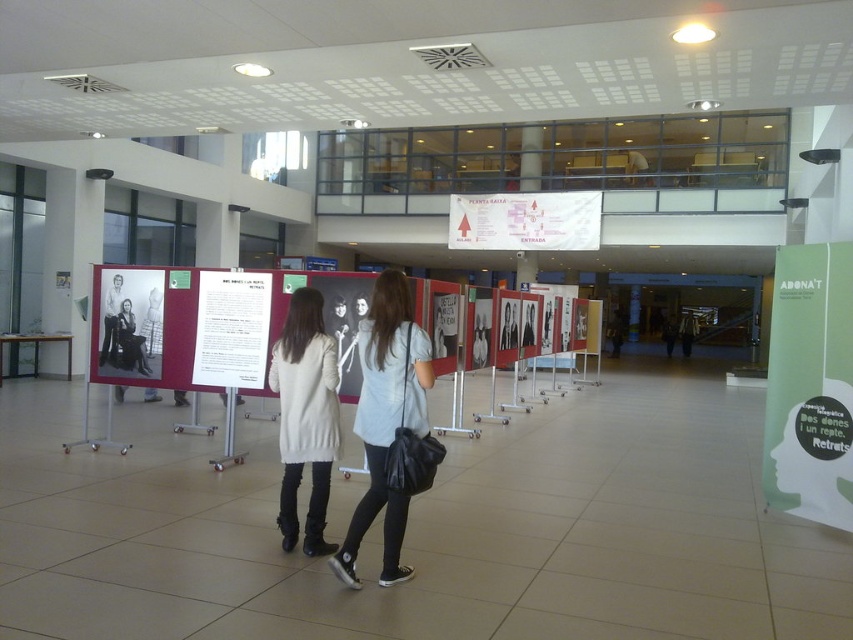
Question: Which of the following is the farthest from the observer?

Choices:
 (A) matte gray shirt at center
 (B) green paperboard poster at right
 (C) white wool coat at center
 (D) white paper map at center

Answer: (D)

Question: Which object is positioned closest to the matte gray shirt at center?

Choices:
 (A) green paperboard poster at right
 (B) white paper at center
 (C) white wool coat at center

Answer: (C)

Question: Is white wool coat at center in front of white paper at center?

Choices:
 (A) no
 (B) yes

Answer: (B)

Question: Does white paper map at center come in front of white paper at center?

Choices:
 (A) no
 (B) yes

Answer: (A)

Question: Considering the real-world distances, which object is closest to the white paper at center?

Choices:
 (A) white wool coat at center
 (B) matte gray shirt at center
 (C) green paperboard poster at right

Answer: (A)

Question: Is white wool coat at center to the left of matte gray shirt at center from the viewer's perspective?

Choices:
 (A) yes
 (B) no

Answer: (A)